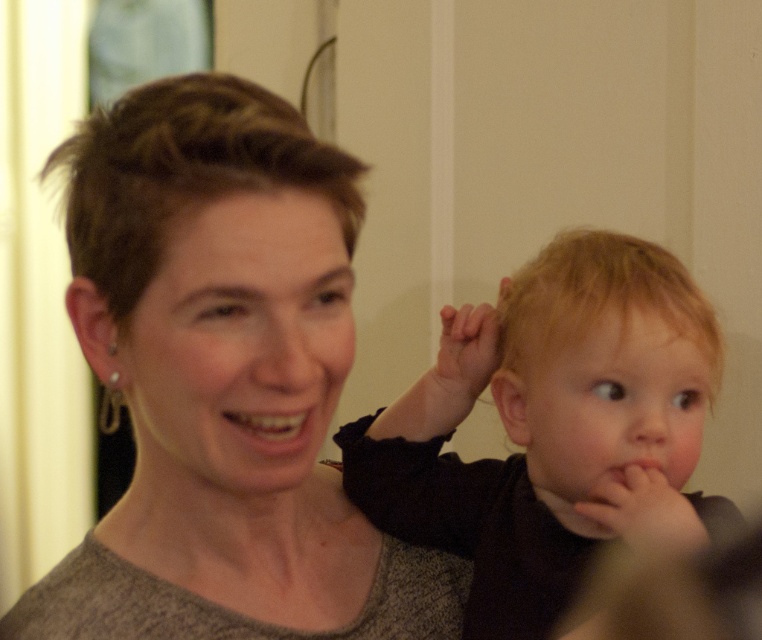
Measure the distance from matte gray sweater at center to blonde hair at right.

matte gray sweater at center is 7.24 inches from blonde hair at right.

Is matte gray sweater at center taller than blonde hair at right?

Indeed, matte gray sweater at center has a greater height compared to blonde hair at right.

The height and width of the screenshot is (640, 762). Describe the element at coordinates (223, 381) in the screenshot. I see `matte gray sweater at center` at that location.

Where is `matte gray sweater at center`? matte gray sweater at center is located at coordinates (223, 381).